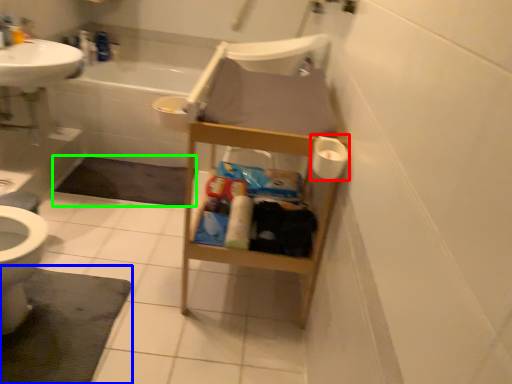
Question: Considering the real-world distances, which object is farthest from toilet paper (highlighted by a red box)? bath mat (highlighted by a blue box) or bath mat (highlighted by a green box)?

Choices:
 (A) bath mat
 (B) bath mat

Answer: (B)